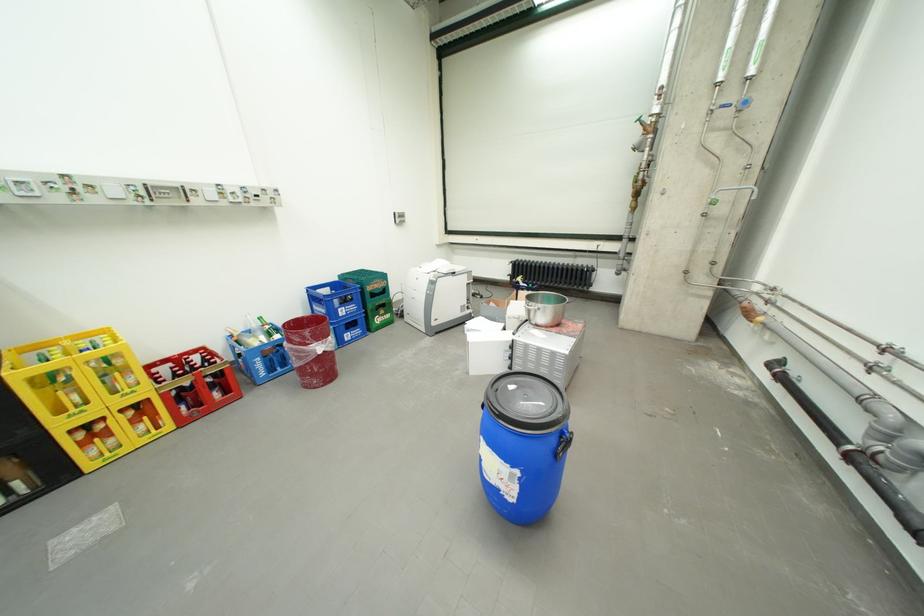
This screenshot has height=616, width=924. What do you see at coordinates (563, 446) in the screenshot? I see `the blue crate handle` at bounding box center [563, 446].